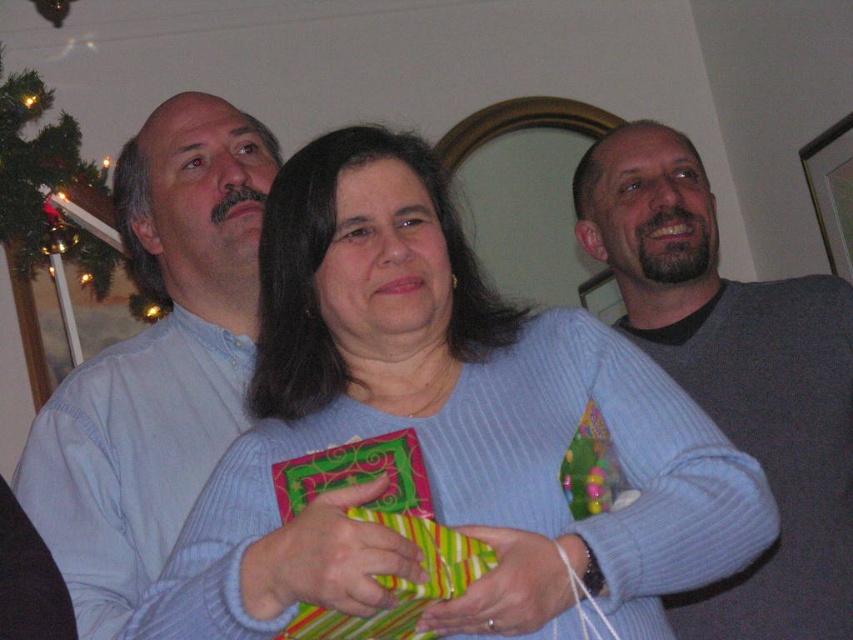
Question: In this image, where is blue ribbed sweater at center located relative to gray ribbed sweater at upper right?

Choices:
 (A) left
 (B) right

Answer: (A)

Question: Estimate the real-world distances between objects in this image. Which object is closer to the blue ribbed sweater at center?

Choices:
 (A) gray ribbed sweater at upper right
 (B) light blue sweater at left

Answer: (B)

Question: Which point is farther to the camera?

Choices:
 (A) (618, 256)
 (B) (724, 484)
 (C) (339, 621)
 (D) (90, 627)

Answer: (A)

Question: Is blue ribbed sweater at center further to the viewer compared to gray ribbed sweater at upper right?

Choices:
 (A) yes
 (B) no

Answer: (B)

Question: Is blue ribbed sweater at center below green striped paper at center?

Choices:
 (A) yes
 (B) no

Answer: (B)

Question: Which object is farther from the camera taking this photo?

Choices:
 (A) light blue sweater at left
 (B) blue ribbed sweater at center

Answer: (A)